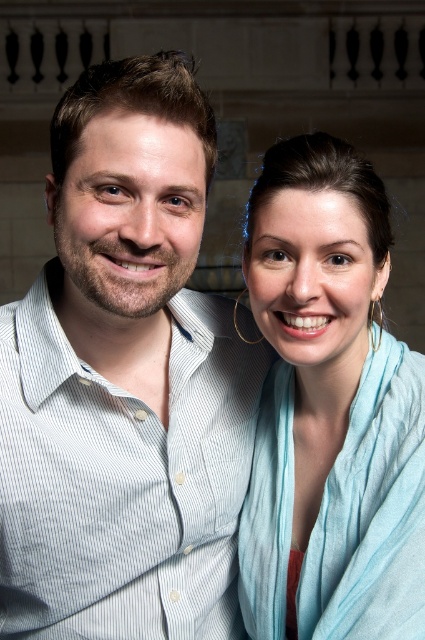
Is light blue silk scarf at right bigger than light blue striped shirt at center?

No.

Is point (294, 280) positioned in front of point (212, 589)?

That is True.

Locate an element on the screen. This screenshot has width=425, height=640. light blue silk scarf at right is located at coordinates (329, 410).